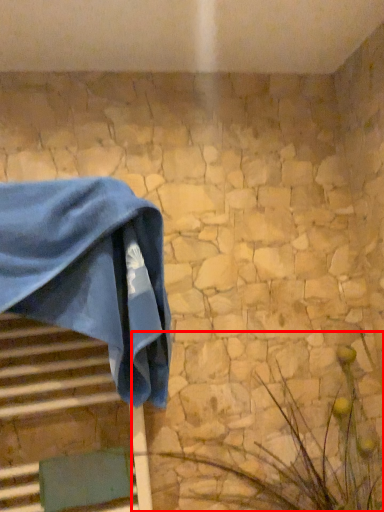
Question: Where is plant (annotated by the red box) located in relation to towel in the image?

Choices:
 (A) right
 (B) left

Answer: (A)